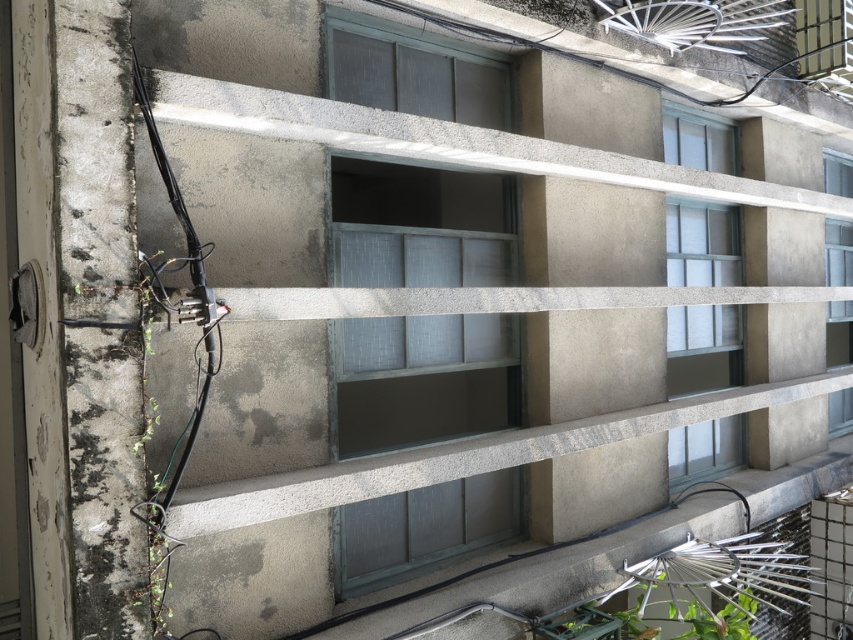
Does green textured glass window at center have a larger size compared to clear glass window at upper right?

Indeed, green textured glass window at center has a larger size compared to clear glass window at upper right.

Does point (440, 244) lie behind point (828, 234)?

No, (440, 244) is closer to viewer.

Image resolution: width=853 pixels, height=640 pixels. What are the coordinates of `green textured glass window at center` in the screenshot? It's located at (422, 380).

Is clear glass window at center-right positioned at the back of clear glass window at upper right?

No.

Can you confirm if clear glass window at center-right is wider than clear glass window at upper right?

Indeed, clear glass window at center-right has a greater width compared to clear glass window at upper right.

Locate an element on the screen. clear glass window at center-right is located at coordinates (703, 348).

Is point (445, 481) closer to viewer compared to point (723, 237)?

Yes, it is in front of point (723, 237).

Is green textured glass window at center smaller than clear glass window at center-right?

Incorrect, green textured glass window at center is not smaller in size than clear glass window at center-right.

Does point (410, 502) come in front of point (724, 336)?

Yes.

At what (x,y) coordinates should I click in order to perform the action: click on green textured glass window at center. Please return your answer as a coordinate pair (x, y). The image size is (853, 640). Looking at the image, I should click on (422, 380).